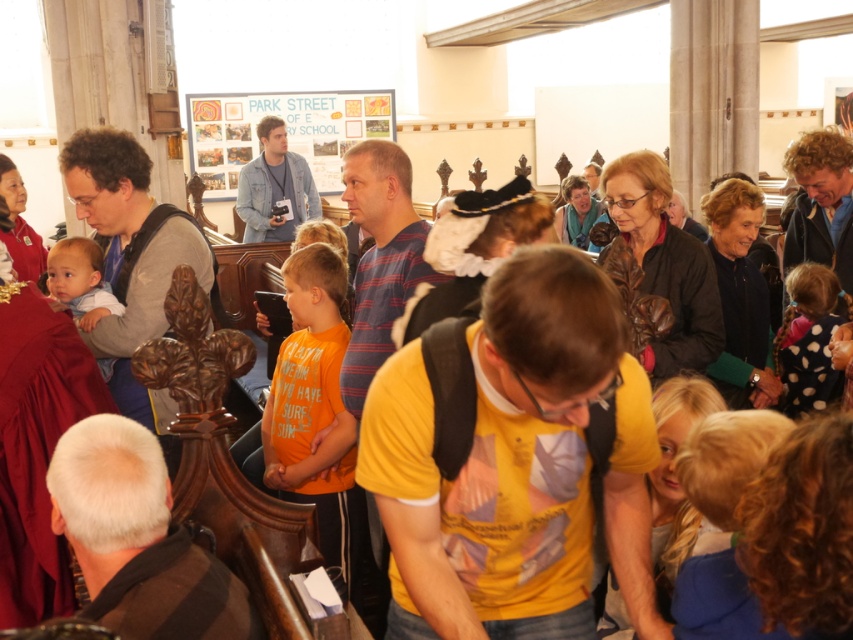
Who is shorter, polka dot dress at right or light blue fabric at left?

light blue fabric at left is shorter.

Does point (816, 385) come in front of point (93, 321)?

No, (816, 385) is behind (93, 321).

Identify the location of polka dot dress at right. The width and height of the screenshot is (853, 640). (805, 339).

Can you confirm if orange cotton shirt at center is positioned to the right of light blue fabric at left?

Yes, orange cotton shirt at center is to the right of light blue fabric at left.

Between orange cotton shirt at center and light blue fabric at left, which one appears on the left side from the viewer's perspective?

From the viewer's perspective, light blue fabric at left appears more on the left side.

Locate an element on the screen. orange cotton shirt at center is located at coordinates (312, 401).

At what (x,y) coordinates should I click in order to perform the action: click on orange cotton shirt at center. Please return your answer as a coordinate pair (x, y). Image resolution: width=853 pixels, height=640 pixels. Looking at the image, I should click on (312, 401).

Is orange cotton shirt at center shorter than polka dot dress at right?

No.

Describe the element at coordinates (312, 401) in the screenshot. The height and width of the screenshot is (640, 853). I see `orange cotton shirt at center` at that location.

Does point (296, 492) come in front of point (827, 285)?

Yes, it is in front of point (827, 285).

I want to click on orange cotton shirt at center, so click(312, 401).